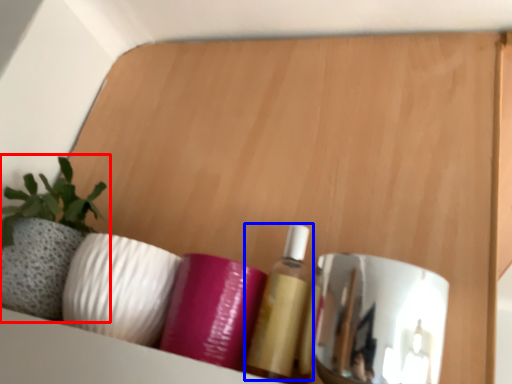
Question: Among these objects, which one is nearest to the camera, houseplant (highlighted by a red box) or toiletry (highlighted by a blue box)?

Choices:
 (A) houseplant
 (B) toiletry

Answer: (B)